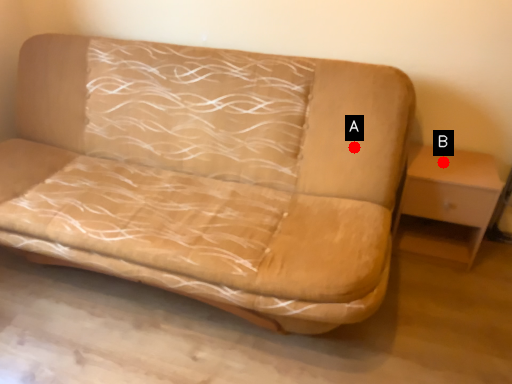
Question: Two points are circled on the image, labeled by A and B beside each circle. Which point is farther from the camera taking this photo?

Choices:
 (A) A is further
 (B) B is further

Answer: (B)